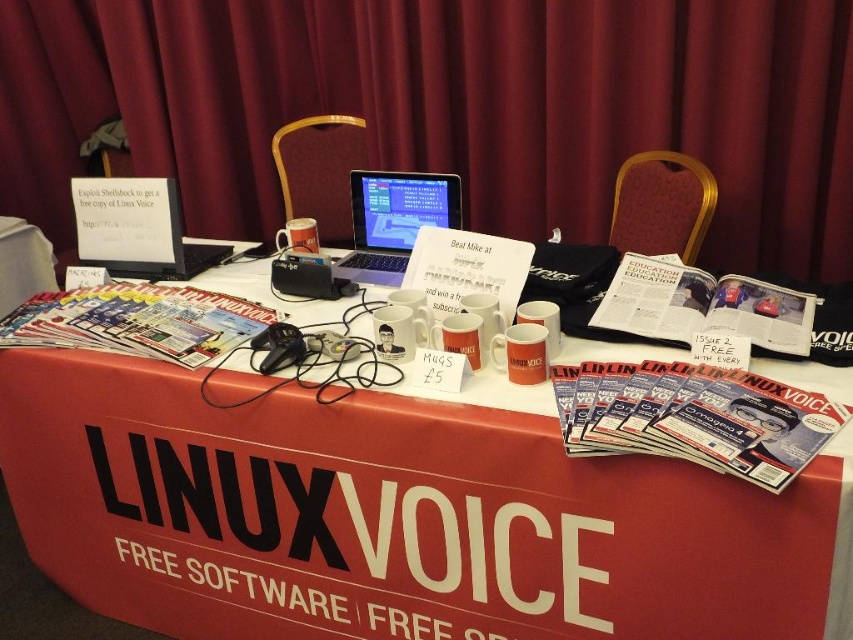
You are organizing a tech event and need to place a large promotional banner between the black plastic laptop at upper left and the silver metallic laptop at center. Which laptop should you position the banner closer to if you want the banner to be centered between them?

The black plastic laptop at upper left is larger than the silver metallic laptop at center. To center the banner between them, position it closer to the smaller silver metallic laptop at center so that the distances from each laptop to the banner are equal.

You are setting up a display at a tech conference and need to stack the black plastic laptop at upper left and the silver metallic laptop at center vertically. Which laptop should you place at the bottom to ensure stability?

The black plastic laptop at upper left has a lesser height compared to the silver metallic laptop at center, so placing the taller silver metallic laptop at center at the bottom would provide better stability.

You are setting up a display at a Linux conference and have a black plastic laptop at upper left and a silver metallic laptop at center. The table has limited space. Which laptop should you place closer to the edge of the table to save space?

The silver metallic laptop at center is narrower, so placing it closer to the edge would save space.